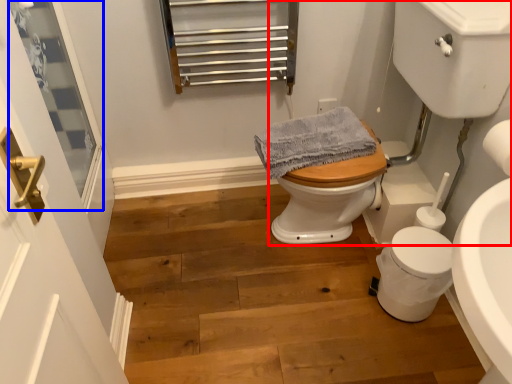
Question: Which point is further to the camera, sink (highlighted by a red box) or window screen (highlighted by a blue box)?

Choices:
 (A) sink
 (B) window screen

Answer: (B)